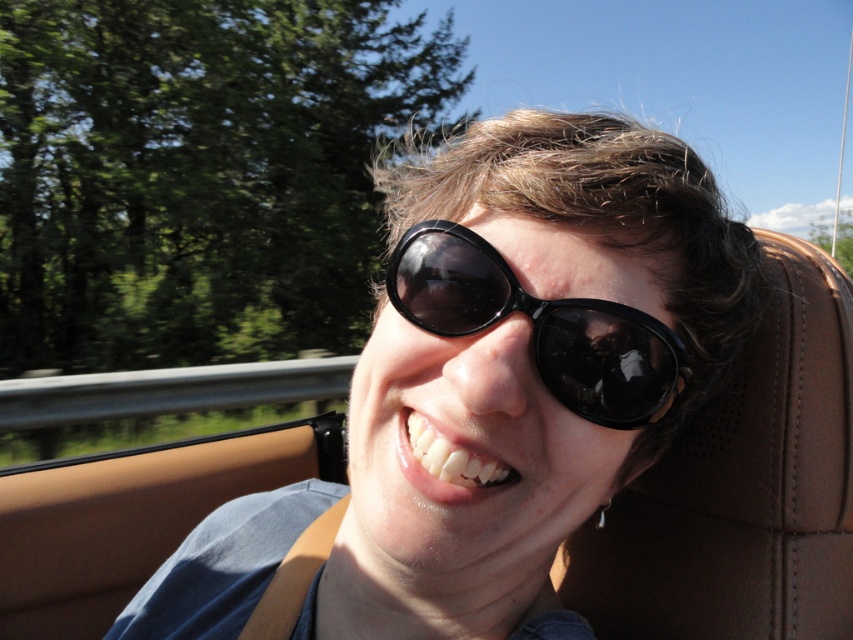
You are a photographer trying to capture a closeup of the sunglasses worn by the person in the convertible. Since both matte black sunglasses at center and black glossy sunglasses at center are visible, which one would you focus on if you want to ensure the sunglasses take up more space in your photo?

The matte black sunglasses at center is bigger than black glossy sunglasses at center, so focusing on the matte black sunglasses at center would make them take up more space in the photo.

The person is wearing the matte black sunglasses at center. If you were to draw a straight line from the bottom of the sunglasses to the top of the guardrail behind them, would this line pass through the person?

Yes, the line from the bottom of the matte black sunglasses at center to the top of the guardrail would pass through the person since the sunglasses are positioned at point (526, 365), which is on the person, and the guardrail is behind them.

You are a photographer standing at a certain distance from the convertible car. You want to take a closeup shot of the black glossy sunglasses at center without moving the camera. Is it possible to adjust the camera settings to focus on the sunglasses effectively?

Yes, since the black glossy sunglasses at center are 42.46 centimeters away from the camera, adjusting the camera focus settings can allow for a clear closeup shot without needing to move the camera.